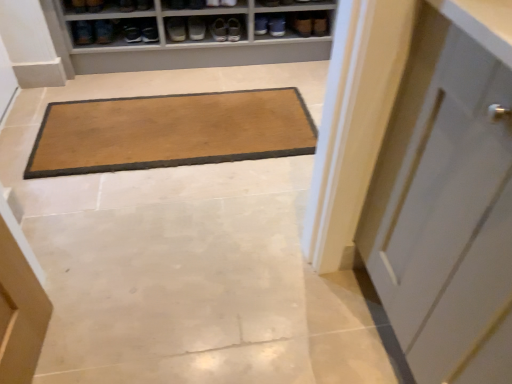
Where is `matte gray shoe at upper center, which ranks as the first footwear in right-to-left order`? The image size is (512, 384). matte gray shoe at upper center, which ranks as the first footwear in right-to-left order is located at coordinates (196, 28).

What do you see at coordinates (196, 28) in the screenshot? The image size is (512, 384). I see `matte gray shoe at upper center, positioned as the 5th footwear in left-to-right order` at bounding box center [196, 28].

Describe the element at coordinates (143, 5) in the screenshot. The height and width of the screenshot is (384, 512). I see `matte black shoe at upper center, which ranks as the second shoe in right-to-left order` at that location.

Where is `matte brown shoe at upper center, the 2th footwear positioned from the right`? matte brown shoe at upper center, the 2th footwear positioned from the right is located at coordinates (176, 29).

What do you see at coordinates (176, 29) in the screenshot? I see `matte brown shoe at upper center, the 2th footwear positioned from the right` at bounding box center [176, 29].

What do you see at coordinates (83, 32) in the screenshot?
I see `matte black shoe at upper left, which is the 5th footwear from right to left` at bounding box center [83, 32].

Identify the location of brown suede shoe at upper center, which ranks as the first shoe in right-to-left order. The width and height of the screenshot is (512, 384). pos(302,24).

Is point (200, 31) behind point (144, 9)?

Yes, it is.

From the picture: Looking at their sizes, would you say matte gray shoe at upper center, which ranks as the first footwear in right-to-left order, is wider or thinner than matte black shoe at upper center, which ranks as the second shoe in right-to-left order?

In the image, matte gray shoe at upper center, which ranks as the first footwear in right-to-left order, appears to be wider than matte black shoe at upper center, which ranks as the second shoe in right-to-left order.

Between matte gray shoe at upper center, which ranks as the first footwear in right-to-left order, and matte black shoe at upper center, arranged as the 4th shoe when viewed from the left, which one is positioned in front?

matte black shoe at upper center, arranged as the 4th shoe when viewed from the left, is more forward.

Considering the sizes of objects matte gray shoe at upper center, positioned as the 5th footwear in left-to-right order, and matte black shoe at upper center, which ranks as the second shoe in right-to-left order, in the image provided, who is shorter, matte gray shoe at upper center, positioned as the 5th footwear in left-to-right order, or matte black shoe at upper center, which ranks as the second shoe in right-to-left order,?

Standing shorter between the two is matte gray shoe at upper center, positioned as the 5th footwear in left-to-right order.

Between matte black shoe at upper left, which is the 5th footwear from right to left, and brown suede shoe at upper center, which ranks as the first shoe in right-to-left order, which one appears on the left side from the viewer's perspective?

Positioned to the left is matte black shoe at upper left, which is the 5th footwear from right to left.

Consider the image. What's the angular difference between matte black shoe at upper left, the 1th footwear in the left-to-right sequence, and brown suede shoe at upper center, which is the fifth shoe from left to right,'s facing directions?

The angular difference between matte black shoe at upper left, the 1th footwear in the left-to-right sequence, and brown suede shoe at upper center, which is the fifth shoe from left to right, is 9.12 degrees.

From the image's perspective, would you say matte black shoe at upper left, which is the 5th footwear from right to left, is shown under brown suede shoe at upper center, which ranks as the first shoe in right-to-left order?

Yes, from the image's perspective, matte black shoe at upper left, which is the 5th footwear from right to left, is below brown suede shoe at upper center, which ranks as the first shoe in right-to-left order.

Is matte black shoe at upper left, the 1th footwear in the left-to-right sequence, positioned with its back to brown suede shoe at upper center, which is the fifth shoe from left to right?

That's not correct — matte black shoe at upper left, the 1th footwear in the left-to-right sequence, is not looking away from brown suede shoe at upper center, which is the fifth shoe from left to right.

Are brown suede shoe at upper left, which ranks as the fifth shoe in right-to-left order, and matte brown shoe at upper center, the fourth footwear viewed from the left, far apart?

brown suede shoe at upper left, which ranks as the fifth shoe in right-to-left order, is actually quite close to matte brown shoe at upper center, the fourth footwear viewed from the left.

Which of these two, brown suede shoe at upper left, marked as the 1th shoe in a left-to-right arrangement, or matte brown shoe at upper center, the 2th footwear positioned from the right, is thinner?

With smaller width is brown suede shoe at upper left, marked as the 1th shoe in a left-to-right arrangement.

Does brown suede shoe at upper left, which ranks as the fifth shoe in right-to-left order, have a smaller size compared to matte brown shoe at upper center, the 2th footwear positioned from the right?

No.

Does matte brown shoe at upper center, which ranks as the 3th shoe in right-to-left order, appear on the left side of matte brown shoe at upper center, the 2th footwear positioned from the right?

Yes, matte brown shoe at upper center, which ranks as the 3th shoe in right-to-left order, is to the left of matte brown shoe at upper center, the 2th footwear positioned from the right.

Looking at this image, how many degrees apart are the facing directions of matte brown shoe at upper center, the third shoe viewed from the left, and matte brown shoe at upper center, the 2th footwear positioned from the right?

They differ by 2.1 degrees in their facing directions.

Is matte brown shoe at upper center, which ranks as the 3th shoe in right-to-left order, inside the boundaries of matte brown shoe at upper center, the fourth footwear viewed from the left, or outside?

matte brown shoe at upper center, which ranks as the 3th shoe in right-to-left order, lies outside matte brown shoe at upper center, the fourth footwear viewed from the left.

Would you consider matte brown shoe at upper center, which ranks as the 3th shoe in right-to-left order, to be distant from matte brown shoe at upper center, the 2th footwear positioned from the right?

matte brown shoe at upper center, which ranks as the 3th shoe in right-to-left order, is near matte brown shoe at upper center, the 2th footwear positioned from the right, not far away.

Is matte black shoe at upper center, arranged as the 4th shoe when viewed from the left, positioned with its back to brown suede shoe at upper left, which ranks as the fifth shoe in right-to-left order?

That's not correct — matte black shoe at upper center, arranged as the 4th shoe when viewed from the left, is not looking away from brown suede shoe at upper left, which ranks as the fifth shoe in right-to-left order.

Considering the sizes of matte black shoe at upper center, which ranks as the second shoe in right-to-left order, and brown suede shoe at upper left, marked as the 1th shoe in a left-to-right arrangement, in the image, is matte black shoe at upper center, which ranks as the second shoe in right-to-left order, wider or thinner than brown suede shoe at upper left, marked as the 1th shoe in a left-to-right arrangement,?

Considering their sizes, matte black shoe at upper center, which ranks as the second shoe in right-to-left order, looks broader than brown suede shoe at upper left, marked as the 1th shoe in a left-to-right arrangement.

From the image's perspective, which shoe is the 4th one above the brown suede shoe at upper left, marked as the 1th shoe in a left-to-right arrangement? Please provide its 2D coordinates.

[(143, 5)]

From a real-world perspective, is matte black shoe at upper center, which ranks as the second shoe in right-to-left order, above or below brown suede shoe at upper left, marked as the 1th shoe in a left-to-right arrangement?

matte black shoe at upper center, which ranks as the second shoe in right-to-left order, is below brown suede shoe at upper left, marked as the 1th shoe in a left-to-right arrangement.

Which is less distant, (77, 2) or (103, 40)?

Point (77, 2).

Locate an element on the screen. the 2nd footwear behind the brown suede shoe at upper left, marked as the 1th shoe in a left-to-right arrangement, starting your count from the anchor is located at coordinates (104, 31).

How many degrees apart are the facing directions of brown suede shoe at upper left, marked as the 1th shoe in a left-to-right arrangement, and matte black shoe at upper left, the fourth footwear from the right?

There is a 5.73-degree angle between the facing directions of brown suede shoe at upper left, marked as the 1th shoe in a left-to-right arrangement, and matte black shoe at upper left, the fourth footwear from the right.

From the image's perspective, is brown suede shoe at upper left, which ranks as the fifth shoe in right-to-left order, over matte black shoe at upper left, the fourth footwear from the right?

Indeed, from the image's perspective, brown suede shoe at upper left, which ranks as the fifth shoe in right-to-left order, is shown above matte black shoe at upper left, the fourth footwear from the right.

Is matte black shoe at upper left, the 1th footwear in the left-to-right sequence, positioned beyond the bounds of matte black shoe at upper left, arranged as the 2th footwear when viewed from the left?

That's correct, matte black shoe at upper left, the 1th footwear in the left-to-right sequence, is outside of matte black shoe at upper left, arranged as the 2th footwear when viewed from the left.

Is the depth of matte black shoe at upper left, which is the 5th footwear from right to left, less than that of matte black shoe at upper left, the fourth footwear from the right?

Yes, it is.

Which is in front, point (90, 35) or point (106, 38)?

The point (90, 35) is closer.

Considering the sizes of matte black shoe at upper left, the 1th footwear in the left-to-right sequence, and matte black shoe at upper left, the fourth footwear from the right, in the image, is matte black shoe at upper left, the 1th footwear in the left-to-right sequence, wider or thinner than matte black shoe at upper left, the fourth footwear from the right,?

Clearly, matte black shoe at upper left, the 1th footwear in the left-to-right sequence, has less width compared to matte black shoe at upper left, the fourth footwear from the right.

From the matte gray shoe at upper center, positioned as the 5th footwear in left-to-right order, count the 1st shoe to the left and point to it. Please provide its 2D coordinates.

[(143, 5)]

What are the coordinates of `the 3rd footwear located above the brown suede shoe at upper center, which is the fifth shoe from left to right (from a real-world perspective)` in the screenshot? It's located at (83, 32).

Considering their positions, is matte black shoe at upper center, which ranks as the second shoe in right-to-left order, positioned closer to matte gray shoe at upper center, which ranks as the first footwear in right-to-left order, than matte brown shoe at upper center, the 2th footwear positioned from the right?

matte brown shoe at upper center, the 2th footwear positioned from the right, lies closer to matte gray shoe at upper center, which ranks as the first footwear in right-to-left order, than the other object.

Estimate the real-world distances between objects in this image. Which object is further from matte brown shoe at upper center, which ranks as the 3th shoe in right-to-left order, matte brown shoe at upper center, the fourth footwear viewed from the left, or matte gray shoe at upper center, which ranks as the first footwear in right-to-left order?

Based on the image, matte gray shoe at upper center, which ranks as the first footwear in right-to-left order, appears to be further to matte brown shoe at upper center, which ranks as the 3th shoe in right-to-left order.

Based on their spatial positions, is brown suede shoe at upper left, which is the 4th shoe from right to left, or matte gray shoe at upper center, which ranks as the first footwear in right-to-left order, closer to matte black shoe at upper center, arranged as the 4th shoe when viewed from the left?

brown suede shoe at upper left, which is the 4th shoe from right to left, is positioned closer to the anchor matte black shoe at upper center, arranged as the 4th shoe when viewed from the left.

Based on their spatial positions, is brown suede shoe at upper center, which is the fifth shoe from left to right, or matte brown shoe at upper center, the fourth footwear viewed from the left, closer to matte black shoe at upper left, which is counted as the third footwear, starting from the left?

The object closer to matte black shoe at upper left, which is counted as the third footwear, starting from the left, is matte brown shoe at upper center, the fourth footwear viewed from the left.

Considering their positions, is matte brown shoe at upper center, the third shoe viewed from the left, positioned closer to matte black shoe at upper center, arranged as the 4th shoe when viewed from the left, than brown suede shoe at upper center, which is the fifth shoe from left to right?

matte brown shoe at upper center, the third shoe viewed from the left, lies closer to matte black shoe at upper center, arranged as the 4th shoe when viewed from the left, than the other object.

Estimate the real-world distances between objects in this image. Which object is closer to matte black shoe at upper left, the 1th footwear in the left-to-right sequence, matte gray shoe at upper center, positioned as the 5th footwear in left-to-right order, or matte black shoe at upper left, which is counted as the third footwear, starting from the left?

matte black shoe at upper left, which is counted as the third footwear, starting from the left, is positioned closer to the anchor matte black shoe at upper left, the 1th footwear in the left-to-right sequence.

Based on their spatial positions, is matte brown shoe at upper center, the third shoe viewed from the left, or matte black shoe at upper left, the fourth footwear from the right, further from matte black shoe at upper left, which is the third footwear in right-to-left order?

matte brown shoe at upper center, the third shoe viewed from the left.

Estimate the real-world distances between objects in this image. Which object is closer to matte black shoe at upper left, the fourth footwear from the right, matte black shoe at upper left, which is the 5th footwear from right to left, or brown suede shoe at upper center, which is the fifth shoe from left to right?

matte black shoe at upper left, which is the 5th footwear from right to left.

The image size is (512, 384). Identify the location of footwear situated between brown suede shoe at upper left, which is the 4th shoe from right to left, and matte brown shoe at upper center, the 2th footwear positioned from the right, from left to right. (132, 33).

Locate an element on the screen. Image resolution: width=512 pixels, height=384 pixels. footwear located between matte black shoe at upper center, which ranks as the second shoe in right-to-left order, and matte gray shoe at upper center, which ranks as the first footwear in right-to-left order, in the left-right direction is located at coordinates (176, 29).

Identify the location of footwear situated between brown suede shoe at upper left, which ranks as the fifth shoe in right-to-left order, and matte black shoe at upper left, which is the third footwear in right-to-left order, from left to right. (104, 31).

Where is `shoe between matte brown shoe at upper center, the third shoe viewed from the left, and matte black shoe at upper left, which is counted as the third footwear, starting from the left, along the z-axis`? shoe between matte brown shoe at upper center, the third shoe viewed from the left, and matte black shoe at upper left, which is counted as the third footwear, starting from the left, along the z-axis is located at coordinates (143, 5).